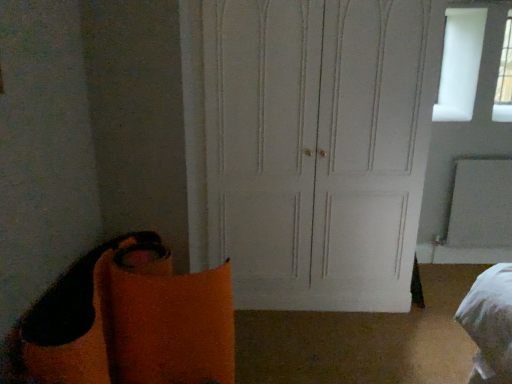
Question: Is white matte door at center taller than transparent glass window at upper right?

Choices:
 (A) no
 (B) yes

Answer: (B)

Question: From a real-world perspective, is white matte door at center on transparent glass window at upper right?

Choices:
 (A) yes
 (B) no

Answer: (B)

Question: Is white matte door at center further to the viewer compared to transparent glass window at upper right?

Choices:
 (A) no
 (B) yes

Answer: (A)

Question: Is white matte door at center wider than transparent glass window at upper right?

Choices:
 (A) no
 (B) yes

Answer: (B)

Question: Can you confirm if white matte door at center is positioned to the right of transparent glass window at upper right?

Choices:
 (A) no
 (B) yes

Answer: (A)

Question: Are white matte door at center and transparent glass window at upper right making contact?

Choices:
 (A) no
 (B) yes

Answer: (A)

Question: Is transparent glass window at upper right further to the viewer compared to white matte door at center?

Choices:
 (A) yes
 (B) no

Answer: (A)

Question: Are transparent glass window at upper right and white matte door at center making contact?

Choices:
 (A) no
 (B) yes

Answer: (A)

Question: From the image's perspective, is transparent glass window at upper right on top of white matte door at center?

Choices:
 (A) no
 (B) yes

Answer: (B)

Question: Is transparent glass window at upper right positioned with its back to white matte door at center?

Choices:
 (A) yes
 (B) no

Answer: (B)

Question: Is transparent glass window at upper right shorter than white matte door at center?

Choices:
 (A) no
 (B) yes

Answer: (B)

Question: Would you say white matte door at center is part of transparent glass window at upper right's contents?

Choices:
 (A) no
 (B) yes

Answer: (A)

Question: Is white matte door at center wider or thinner than transparent glass window at upper right?

Choices:
 (A) thin
 (B) wide

Answer: (B)